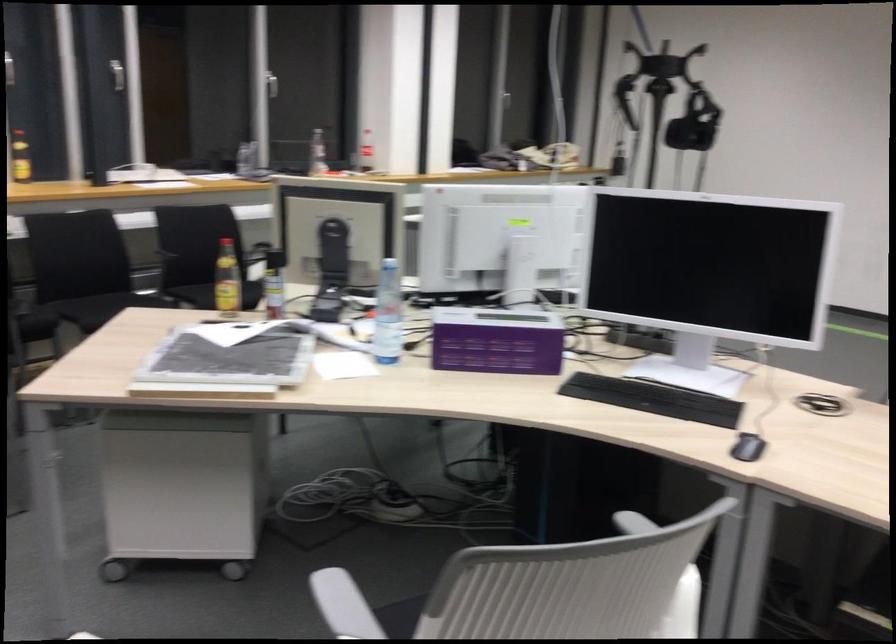
This screenshot has width=896, height=644. Identify the location of phone handset. click(331, 270).